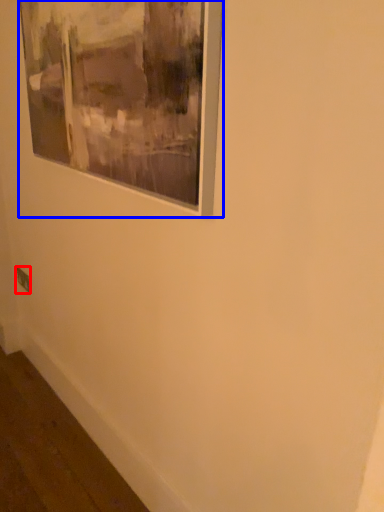
Question: Which object appears farthest to the camera in this image, electric outlet (highlighted by a red box) or picture frame (highlighted by a blue box)?

Choices:
 (A) electric outlet
 (B) picture frame

Answer: (A)